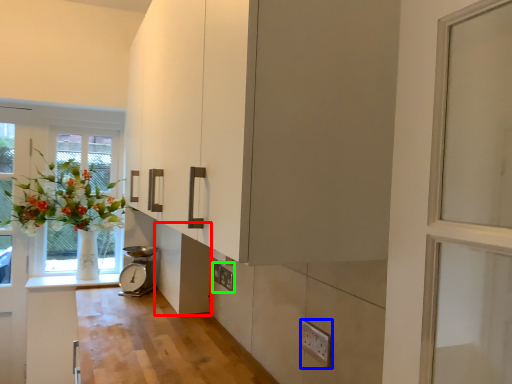
Question: Which object is positioned closest to cabinetry (highlighted by a red box)? Select from electric outlet (highlighted by a blue box) and electric outlet (highlighted by a green box).

Choices:
 (A) electric outlet
 (B) electric outlet

Answer: (B)